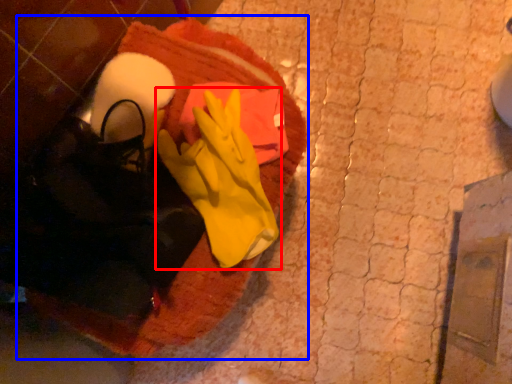
Question: Which object is closer to the camera taking this photo, glove (highlighted by a red box) or blanket (highlighted by a blue box)?

Choices:
 (A) glove
 (B) blanket

Answer: (A)